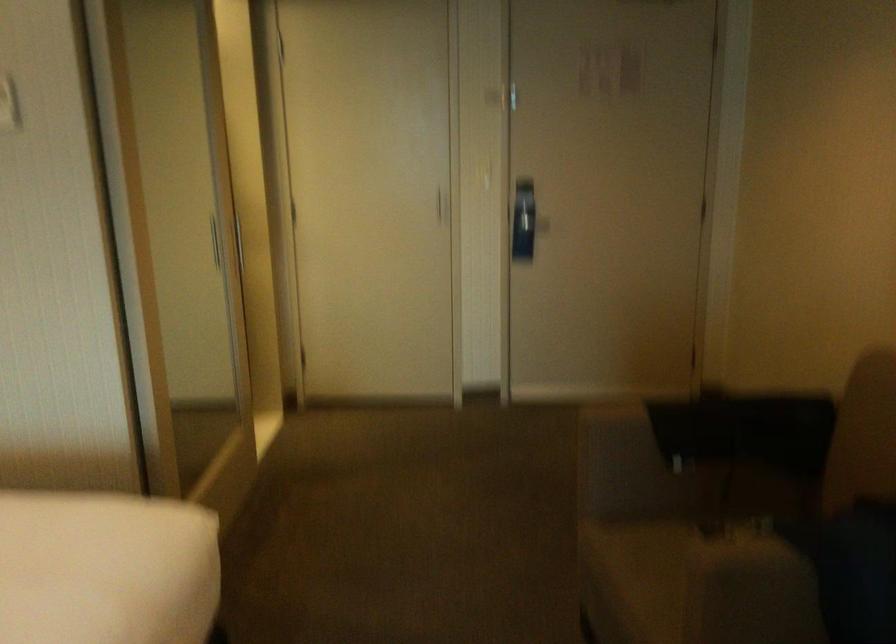
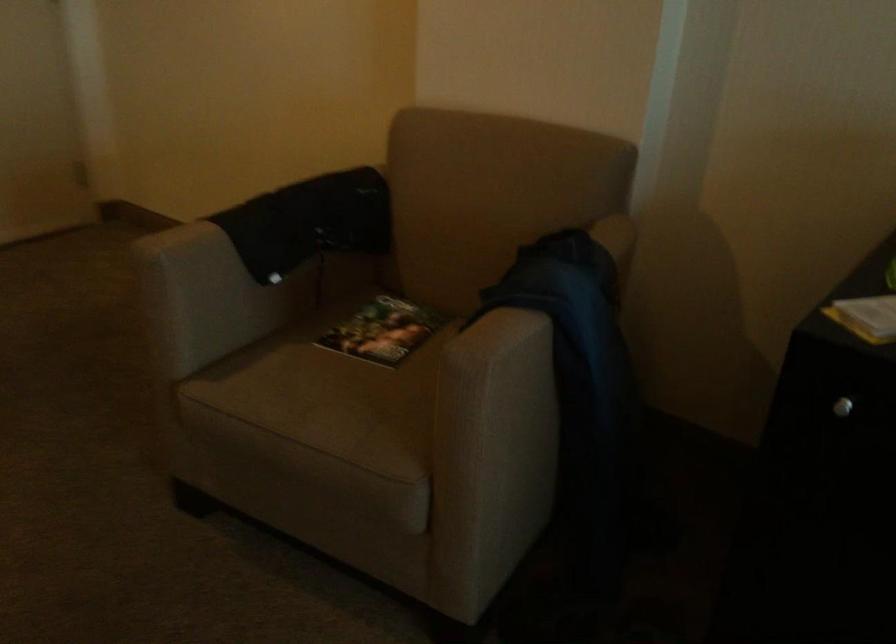
Locate, in the second image, the point that corresponds to point (658, 574) in the first image.

(330, 404)